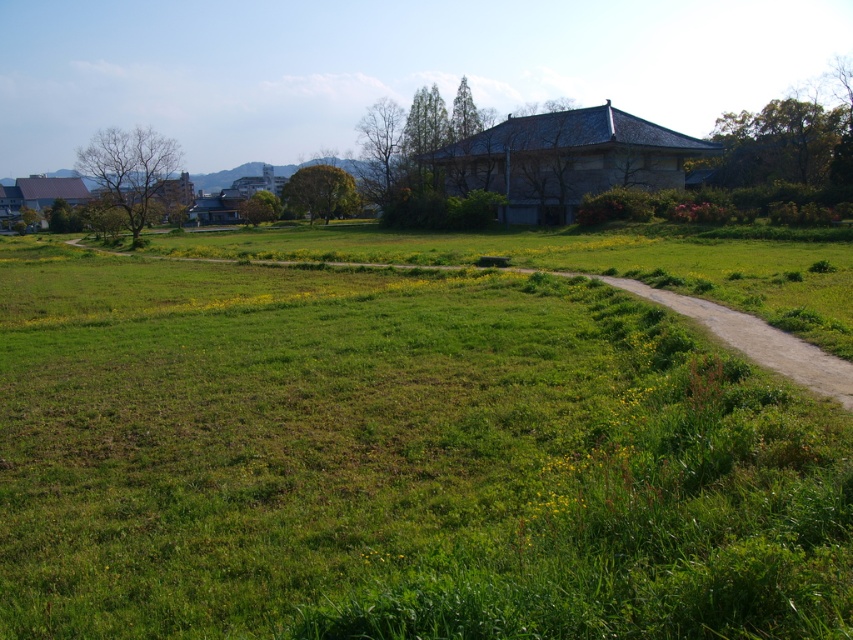
You are standing at the bottom of the image and want to walk towards the green grassy trail at center. Which direction should you look to see the green grassy field at center first?

The green grassy field at center is located below the green grassy trail at center, so you should look downward to see the green grassy field at center first before looking upward towards the trail.